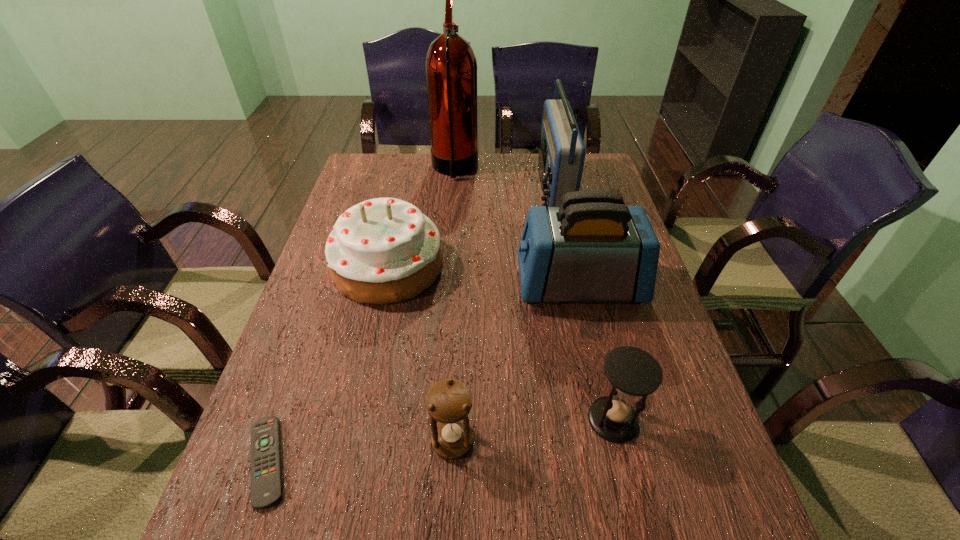
I want to click on vacant space located on the front panel of the radio receiver, so click(x=493, y=191).

Identify the location of vacant region located on the front-facing side of the toaster. (465, 285).

The height and width of the screenshot is (540, 960). I want to click on vacant region located on the front-facing side of the toaster, so click(x=408, y=285).

At what (x,y) coordinates should I click in order to perform the action: click on blank space located 0.400m on the front-facing side of the toaster. Please return your answer as a coordinate pair (x, y). The image size is (960, 540). Looking at the image, I should click on tap(367, 285).

Image resolution: width=960 pixels, height=540 pixels. What are the coordinates of `free space located on the back of the cake` in the screenshot? It's located at (399, 216).

You are a GUI agent. You are given a task and a screenshot of the screen. Output one action in this format:
    pyautogui.click(x=<x>, y=<y>)
    Task: Click on the vacant space located on the back of the right hourglass
    
    Given the screenshot: What is the action you would take?
    pyautogui.click(x=580, y=276)

Where is `free space located on the left of the left hourglass`? The image size is (960, 540). free space located on the left of the left hourglass is located at coordinates (355, 441).

Find the location of `free space located on the right of the remote control`. free space located on the right of the remote control is located at coordinates (506, 461).

Where is `fire extinguisher that is at the far edge`? Image resolution: width=960 pixels, height=540 pixels. fire extinguisher that is at the far edge is located at coordinates (450, 66).

The height and width of the screenshot is (540, 960). In order to click on radio receiver at the far edge in this screenshot , I will do `click(561, 157)`.